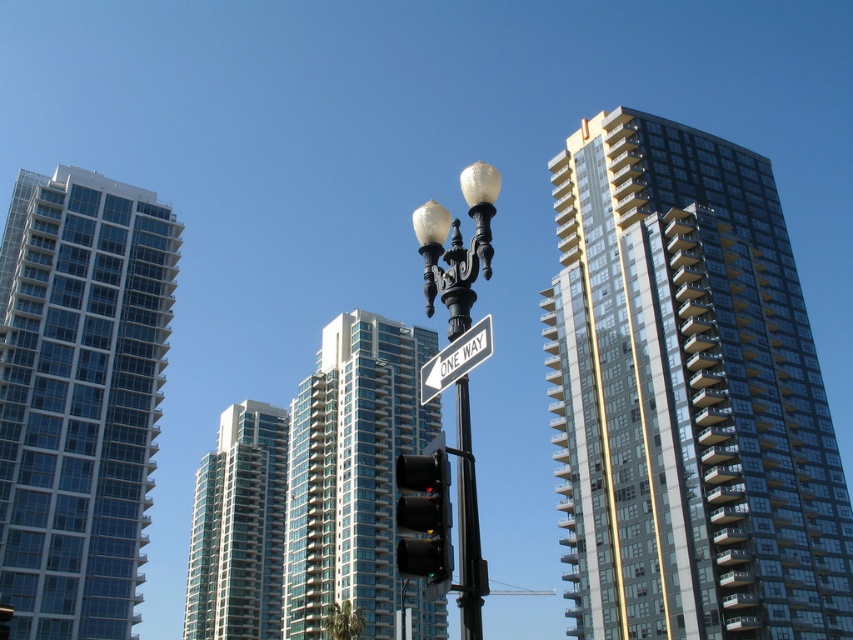
You are a pedestrian standing on the sidewalk and want to take a photo of the glassy reflective building at upper right and the glassy steel building at center. Which building should you focus on first to ensure both are in the frame?

You should focus on the glassy reflective building at upper right first because it is closer to you than the glassy steel building at center, so adjusting the focus from near to far will help capture both in the frame.

Based on the scene description, which of the two buildings, the glassy reflective building at upper right or the glassy steel building at center, is taller?

The glassy reflective building at upper right is taller than the glassy steel building at center.